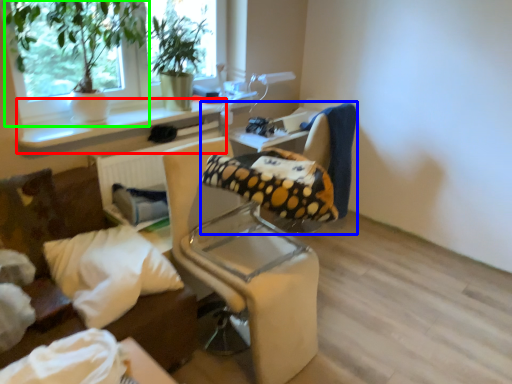
Question: Which object is positioned closest to window sill (highlighted by a red box)? Select from chair (highlighted by a blue box) and houseplant (highlighted by a green box).

Choices:
 (A) chair
 (B) houseplant

Answer: (B)